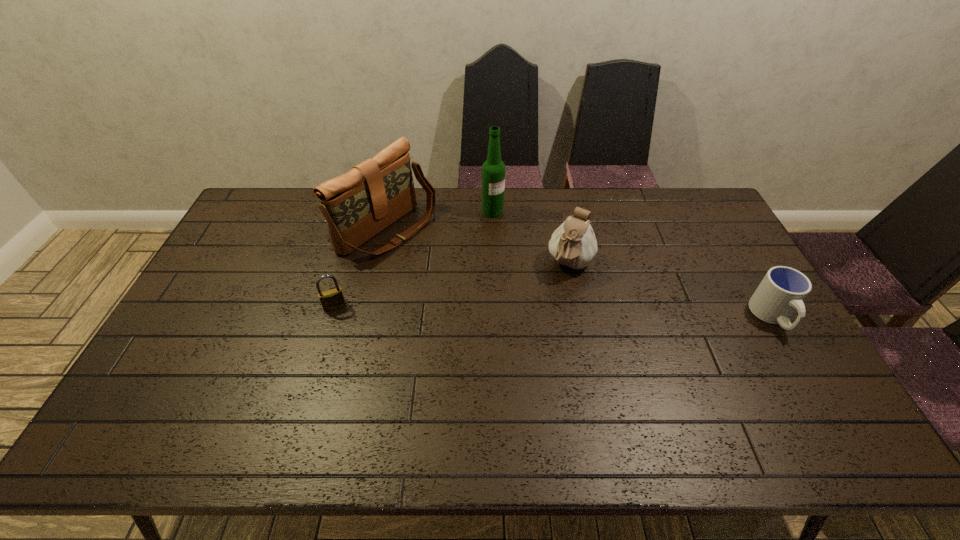
The width and height of the screenshot is (960, 540). Find the location of `vacant spot on the desktop that is between the padlock and the rightmost object and is positioned on the front-facing side of the shoulder bag`. vacant spot on the desktop that is between the padlock and the rightmost object and is positioned on the front-facing side of the shoulder bag is located at coordinates (527, 311).

You are a GUI agent. You are given a task and a screenshot of the screen. Output one action in this format:
    pyautogui.click(x=<x>, y=<y>)
    Task: Click on the free space on the desktop that is between the padlock and the rightmost object and is positioned on the front-facing side of the pouch
    The height and width of the screenshot is (540, 960).
    Given the screenshot: What is the action you would take?
    pyautogui.click(x=546, y=312)

The width and height of the screenshot is (960, 540). In order to click on vacant spot on the desktop that is between the padlock and the cup and is positioned on the label of the third object from left to right in this screenshot , I will do (613, 313).